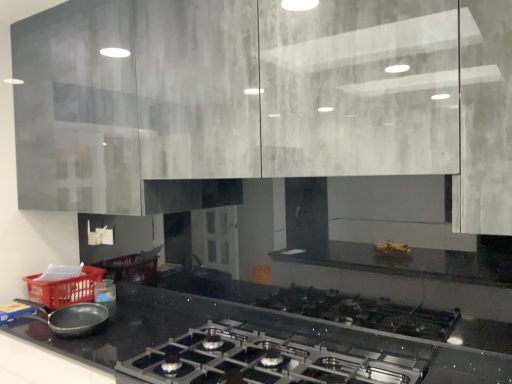
Question: Does satin black gas stove at lower center lie in front of matte black frying pan at lower left?

Choices:
 (A) yes
 (B) no

Answer: (A)

Question: From the image's perspective, would you say satin black gas stove at lower center is positioned over matte black frying pan at lower left?

Choices:
 (A) no
 (B) yes

Answer: (A)

Question: From the image's perspective, would you say satin black gas stove at lower center is shown under matte black frying pan at lower left?

Choices:
 (A) no
 (B) yes

Answer: (B)

Question: Is satin black gas stove at lower center not close to matte black frying pan at lower left?

Choices:
 (A) no
 (B) yes

Answer: (A)

Question: Is satin black gas stove at lower center bigger than matte black frying pan at lower left?

Choices:
 (A) no
 (B) yes

Answer: (B)

Question: Is satin black gas stove at lower center outside matte black frying pan at lower left?

Choices:
 (A) no
 (B) yes

Answer: (B)

Question: Does satin black gas stove at lower center have a lesser height compared to matte gray cabinets at upper center?

Choices:
 (A) yes
 (B) no

Answer: (A)

Question: From the image's perspective, is satin black gas stove at lower center on top of matte gray cabinets at upper center?

Choices:
 (A) yes
 (B) no

Answer: (B)

Question: Does satin black gas stove at lower center touch matte gray cabinets at upper center?

Choices:
 (A) yes
 (B) no

Answer: (B)

Question: From a real-world perspective, is satin black gas stove at lower center below matte gray cabinets at upper center?

Choices:
 (A) no
 (B) yes

Answer: (B)

Question: Considering the relative sizes of satin black gas stove at lower center and matte gray cabinets at upper center in the image provided, is satin black gas stove at lower center wider than matte gray cabinets at upper center?

Choices:
 (A) yes
 (B) no

Answer: (A)

Question: Can you confirm if satin black gas stove at lower center is thinner than matte gray cabinets at upper center?

Choices:
 (A) no
 (B) yes

Answer: (A)

Question: Does matte black frying pan at lower left have a greater width compared to matte gray cabinets at upper center?

Choices:
 (A) yes
 (B) no

Answer: (B)